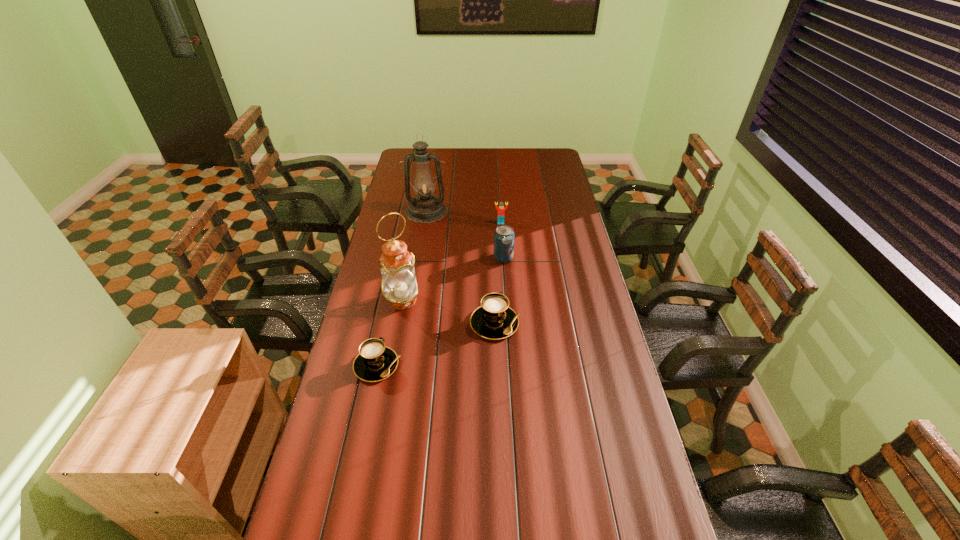
Locate an element on the screen. This screenshot has width=960, height=540. blank space at the near left corner of the desktop is located at coordinates pos(346,507).

I want to click on free space at the far right corner of the desktop, so click(x=540, y=160).

In the image, there is a desktop. Where is `vacant space at the near right corner`? The width and height of the screenshot is (960, 540). vacant space at the near right corner is located at coordinates (638, 501).

What are the coordinates of `free point between the Lego and the left cappuccino` in the screenshot? It's located at (439, 294).

Find the location of `empty space between the right cappuccino and the farther oil lamp`. empty space between the right cappuccino and the farther oil lamp is located at coordinates (461, 267).

Find the location of a particular element. free space between the farther cappuccino and the Lego is located at coordinates (498, 273).

Where is `free spot between the Lego and the nearer oil lamp`? This screenshot has height=540, width=960. free spot between the Lego and the nearer oil lamp is located at coordinates (451, 261).

This screenshot has height=540, width=960. Identify the location of vacant area that lies between the pop soda and the right cappuccino. (499, 291).

Where is `free space between the Lego and the nearer oil lamp`? The width and height of the screenshot is (960, 540). free space between the Lego and the nearer oil lamp is located at coordinates (451, 261).

The image size is (960, 540). Identify the location of vacant region between the shortest object and the Lego. (439, 294).